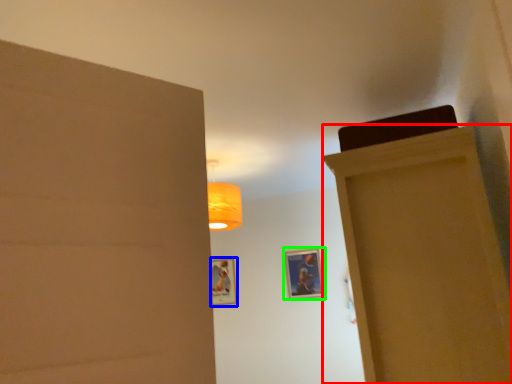
Question: Estimate the real-world distances between objects in this image. Which object is closer to door (highlighted by a red box), picture frame (highlighted by a blue box) or picture frame (highlighted by a green box)?

Choices:
 (A) picture frame
 (B) picture frame

Answer: (B)